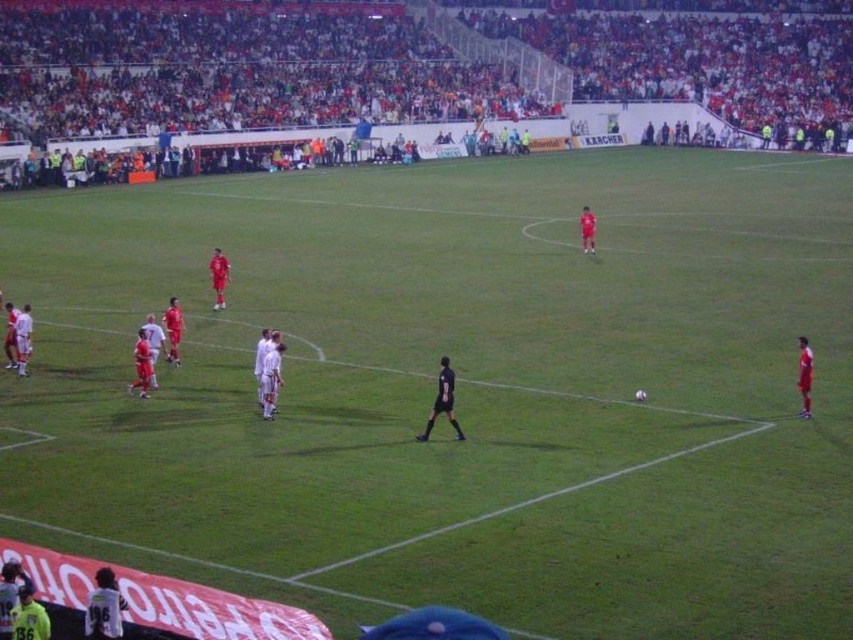
What do you see at coordinates (804, 374) in the screenshot? The width and height of the screenshot is (853, 640). I see `shiny red shorts at right` at bounding box center [804, 374].

Which is above, shiny red shorts at right or pink matte soccer player at center?

pink matte soccer player at center is higher up.

Locate an element on the screen. shiny red shorts at right is located at coordinates (804, 374).

Looking at this image, can you confirm if white jersey at lower left is positioned to the right of matte red shorts at lower left?

Indeed, white jersey at lower left is positioned on the right side of matte red shorts at lower left.

Is white jersey at lower left thinner than matte red shorts at lower left?

Yes.

The height and width of the screenshot is (640, 853). What are the coordinates of `white jersey at lower left` in the screenshot? It's located at (103, 608).

Between matte red shorts at lower left and pink matte soccer player at center, which one has more height?

Standing taller between the two is matte red shorts at lower left.

Which is more to the right, matte red shorts at lower left or pink matte soccer player at center?

From the viewer's perspective, pink matte soccer player at center appears more on the right side.

Does point (171, 328) lie behind point (585, 225)?

No.

The height and width of the screenshot is (640, 853). What are the coordinates of `matte red shorts at lower left` in the screenshot? It's located at (172, 328).